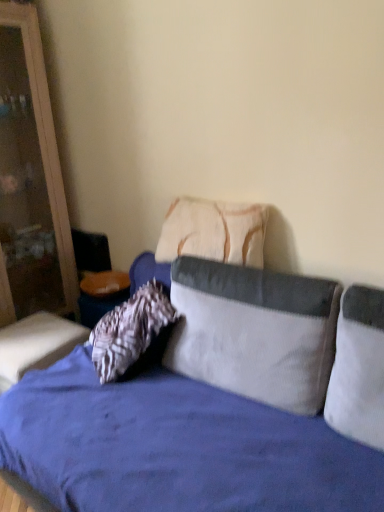
Question: From the image's perspective, is wooden dresser at left on top of white corduroy pillow at center, the second pillow when ordered from back to front?

Choices:
 (A) no
 (B) yes

Answer: (B)

Question: Considering the relative sizes of wooden dresser at left and white corduroy pillow at center, the second pillow when ordered from back to front, in the image provided, is wooden dresser at left taller than white corduroy pillow at center, the second pillow when ordered from back to front,?

Choices:
 (A) no
 (B) yes

Answer: (B)

Question: From the image's perspective, is wooden dresser at left under white corduroy pillow at center, acting as the 2th pillow starting from the front?

Choices:
 (A) no
 (B) yes

Answer: (A)

Question: Can you confirm if wooden dresser at left is positioned to the left of white corduroy pillow at center, acting as the 2th pillow starting from the front?

Choices:
 (A) yes
 (B) no

Answer: (A)

Question: Considering the relative positions of wooden dresser at left and white corduroy pillow at center, the second pillow when ordered from back to front, in the image provided, is wooden dresser at left behind white corduroy pillow at center, the second pillow when ordered from back to front,?

Choices:
 (A) no
 (B) yes

Answer: (B)

Question: Does point (44, 283) appear closer or farther from the camera than point (365, 352)?

Choices:
 (A) farther
 (B) closer

Answer: (A)

Question: In terms of height, does wooden dresser at left look taller or shorter compared to white corduroy pillow at right, the 1th pillow positioned from the front?

Choices:
 (A) tall
 (B) short

Answer: (A)

Question: From a real-world perspective, is wooden dresser at left positioned above or below white corduroy pillow at right, the 1th pillow positioned from the front?

Choices:
 (A) below
 (B) above

Answer: (B)

Question: Is wooden dresser at left in front of or behind white corduroy pillow at right, the 1th pillow positioned from the front, in the image?

Choices:
 (A) behind
 (B) front

Answer: (A)

Question: Looking at their shapes, would you say velvet blue studio couch at center is wider or thinner than white corduroy pillow at right, the 1th pillow positioned from the front?

Choices:
 (A) thin
 (B) wide

Answer: (B)

Question: From the image's perspective, relative to white corduroy pillow at right, the 1th pillow positioned from the front, is velvet blue studio couch at center above or below?

Choices:
 (A) below
 (B) above

Answer: (A)

Question: Considering the positions of point (263, 501) and point (367, 315), is point (263, 501) closer or farther from the camera than point (367, 315)?

Choices:
 (A) farther
 (B) closer

Answer: (B)

Question: Would you say velvet blue studio couch at center is to the left or to the right of white corduroy pillow at right, the 3th pillow viewed from the back, in the picture?

Choices:
 (A) left
 (B) right

Answer: (A)

Question: In the image, is white corduroy pillow at center, the second pillow when ordered from back to front, positioned in front of or behind velvet cushion at lower left?

Choices:
 (A) front
 (B) behind

Answer: (A)

Question: Is white corduroy pillow at center, acting as the 2th pillow starting from the front, wider or thinner than velvet cushion at lower left?

Choices:
 (A) wide
 (B) thin

Answer: (B)